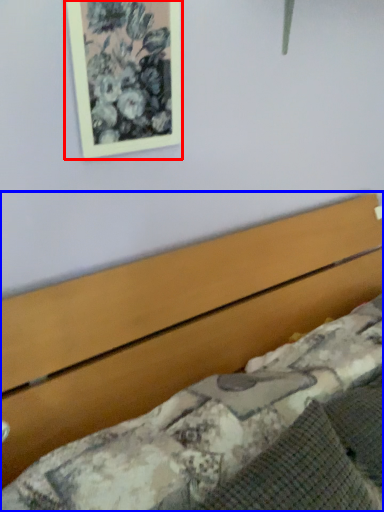
Question: Among these objects, which one is farthest to the camera, picture frame (highlighted by a red box) or bed (highlighted by a blue box)?

Choices:
 (A) picture frame
 (B) bed

Answer: (A)